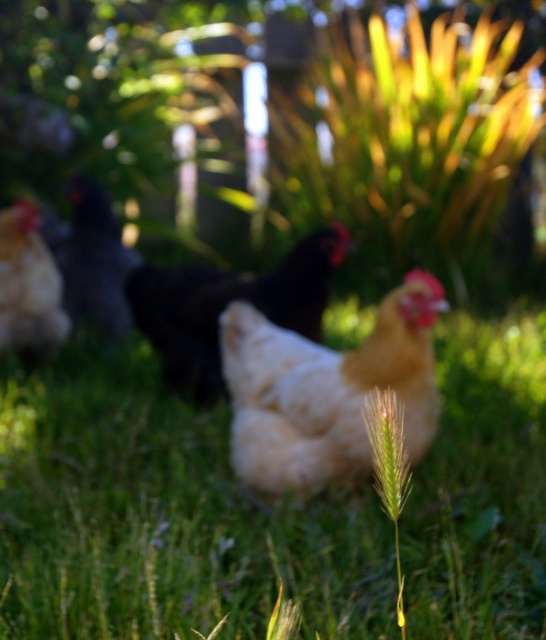
Can you confirm if white matte chicken at center is thinner than black matte chicken at left?

In fact, white matte chicken at center might be wider than black matte chicken at left.

Consider the image. Between white matte chicken at center and black matte chicken at left, which one is positioned higher?

black matte chicken at left

Does point (135, 307) come farther from viewer compared to point (73, 186)?

No, (135, 307) is in front of (73, 186).

Find the location of `white matte chicken at center`. white matte chicken at center is located at coordinates (227, 304).

Between white fluffy chicken at center and white matte chicken at center, which one has more height?

Standing taller between the two is white matte chicken at center.

Which is below, white fluffy chicken at center or white matte chicken at center?

white fluffy chicken at center is below.

Who is more forward, (325, 435) or (139, 269)?

Positioned in front is point (325, 435).

Locate an element on the screen. The width and height of the screenshot is (546, 640). white fluffy chicken at center is located at coordinates (327, 388).

Is point (87, 205) farther from camera compared to point (38, 314)?

Yes, it is behind point (38, 314).

Which is behind, point (64, 282) or point (50, 280)?

Positioned behind is point (64, 282).

Identify the location of black matte chicken at left. (93, 260).